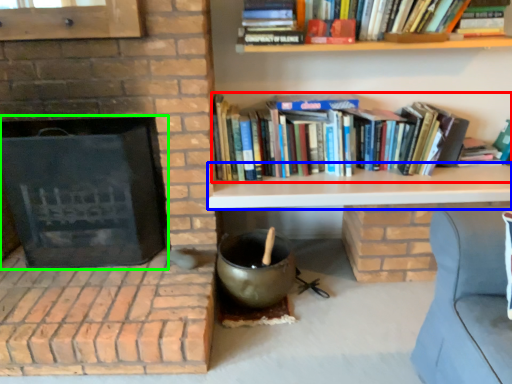
Question: Considering the real-world distances, which object is closest to book (highlighted by a red box)? table (highlighted by a blue box) or fireplace (highlighted by a green box).

Choices:
 (A) table
 (B) fireplace

Answer: (A)